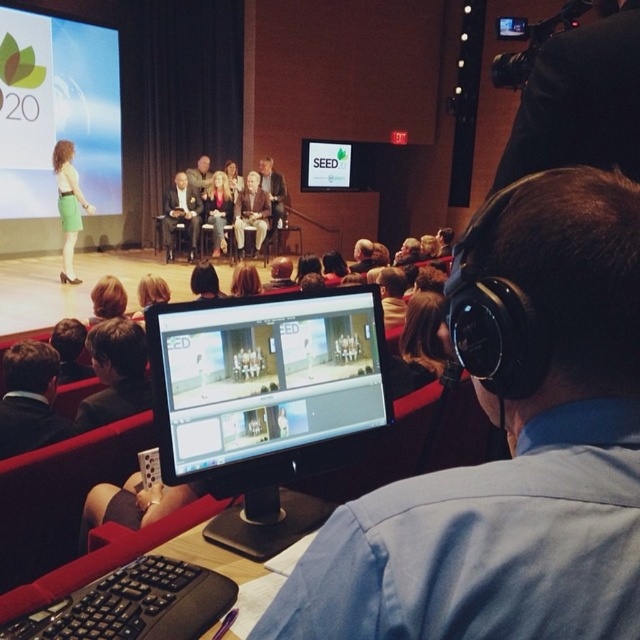
Question: Which object is farther from the camera taking this photo?

Choices:
 (A) matte white monitor at center
 (B) light brown leather jacket at center
 (C) matte black monitor at center

Answer: (A)

Question: Is matte green skirt at left below light brown leather jacket at center?

Choices:
 (A) no
 (B) yes

Answer: (B)

Question: Can you confirm if matte black monitor at center is positioned above matte black jacket at center?

Choices:
 (A) no
 (B) yes

Answer: (A)

Question: Based on their relative distances, which object is nearer to the light brown leather jacket at center?

Choices:
 (A) matte white monitor at center
 (B) matte black monitor at center

Answer: (A)

Question: Which point is closer to the camera?

Choices:
 (A) (49, 442)
 (B) (253, 246)
 (C) (65, 259)
 (D) (182, 209)

Answer: (A)

Question: Is dark brown leather jacket at lower left below matte black suit at center?

Choices:
 (A) yes
 (B) no

Answer: (A)